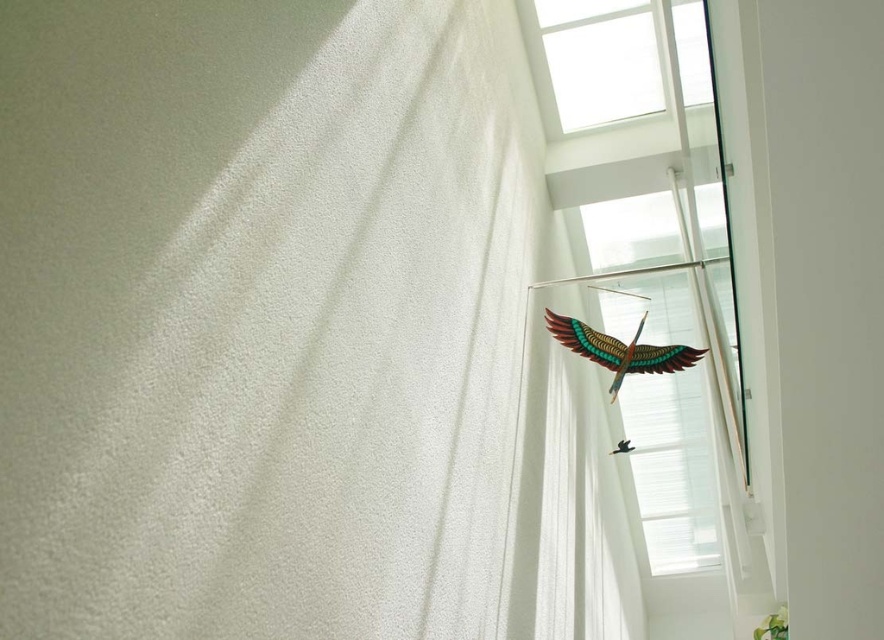
You are standing in the room and want to place a small plant between the two points, point (694, 372) and point (623, 58). Since the points are at different depths, which point should the plant be closer to so it doesn not block the light coming from the skylight?

The plant should be placed closer to point (623, 58) because point (694, 372) is behind it, so placing the plant closer to the front point would avoid blocking the light from the skylight.

You are an interior designer assessing the space. You need to determine if the white textured curtain at upper right can fully cover the wooden bird at upper right when closed. Based on their widths, can the curtain cover the bird?

The white textured curtain at upper right has a lesser width compared to wooden bird at upper right, so the curtain cannot fully cover the bird when closed.

You are standing in the room and want to block some sunlight coming through the transparent glass window at upper right and white textured curtain at upper right. Which object can you adjust to achieve this?

The white textured curtain at upper right can be adjusted to block sunlight since it has a greater height compared to the transparent glass window at upper right, allowing it to cover more of the window area.